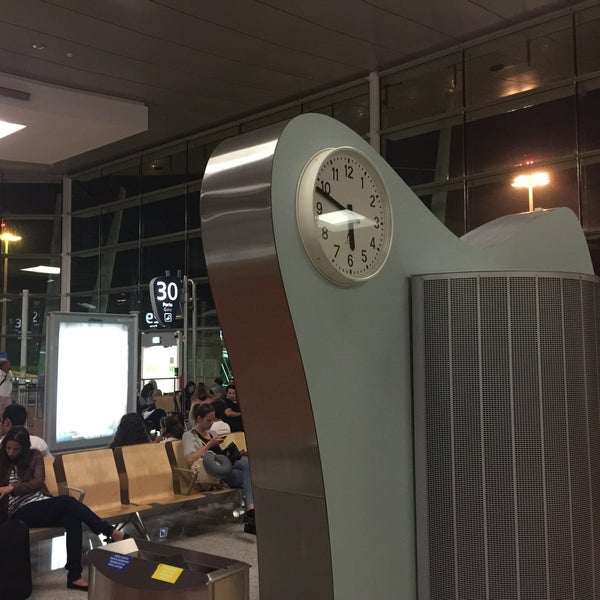
Where is `minute hand of clock`? The width and height of the screenshot is (600, 600). minute hand of clock is located at coordinates (336, 205).